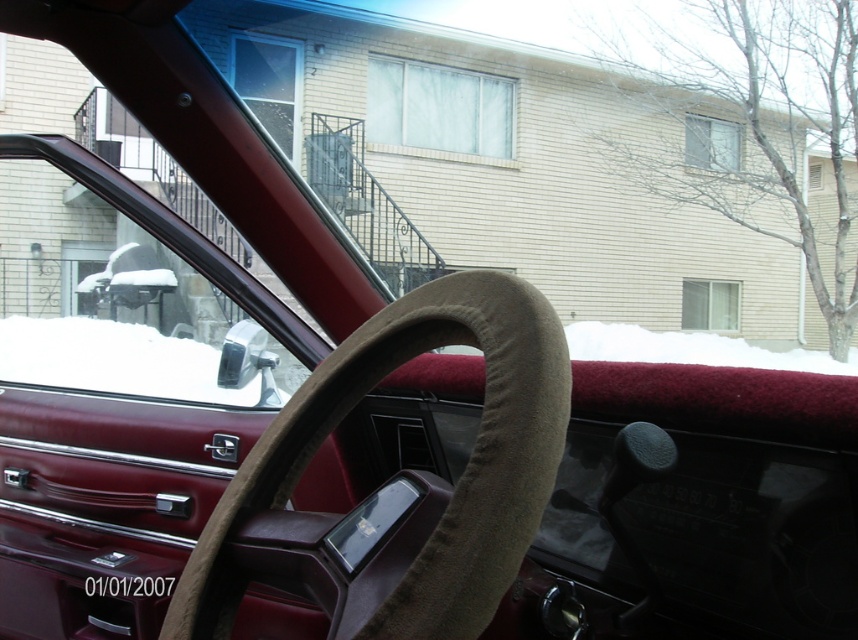
Question: Which of the following is the farthest from the observer?

Choices:
 (A) brown suede steering wheel at center
 (B) white fluffy snow at center

Answer: (B)

Question: In this image, where is brown suede steering wheel at center located relative to white fluffy snow at center?

Choices:
 (A) below
 (B) above

Answer: (B)

Question: Does brown suede steering wheel at center have a smaller size compared to white fluffy snow at center?

Choices:
 (A) no
 (B) yes

Answer: (B)

Question: Can you confirm if brown suede steering wheel at center is positioned below white fluffy snow at center?

Choices:
 (A) no
 (B) yes

Answer: (A)

Question: Which object is farther from the camera taking this photo?

Choices:
 (A) white fluffy snow at center
 (B) brown suede steering wheel at center

Answer: (A)